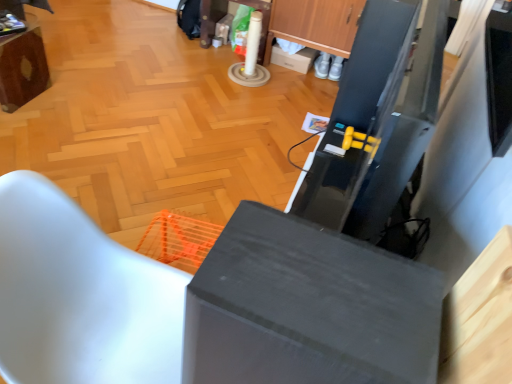
Question: Is white cardboard box at center in front of or behind white matte chair at lower left, positioned as the 1th furniture in right-to-left order, in the image?

Choices:
 (A) behind
 (B) front

Answer: (A)

Question: Based on their positions, is white cardboard box at center located to the left or right of white matte chair at lower left, positioned as the 1th furniture in right-to-left order?

Choices:
 (A) right
 (B) left

Answer: (A)

Question: Which object is positioned farthest from the wooden table at upper left, arranged as the 2th furniture when viewed from the front?

Choices:
 (A) wooden cabinet at upper center
 (B) white matte chair at lower left, positioned as the 1th furniture in right-to-left order
 (C) white cardboard box at center
 (D) matte gray cabinet at center

Answer: (D)

Question: Estimate the real-world distances between objects in this image. Which object is closer to the matte gray cabinet at center?

Choices:
 (A) wooden table at upper left, the 1th furniture viewed from the left
 (B) wooden cabinet at upper center
 (C) white cardboard box at center
 (D) white matte chair at lower left, arranged as the 2th furniture when viewed from the top

Answer: (D)